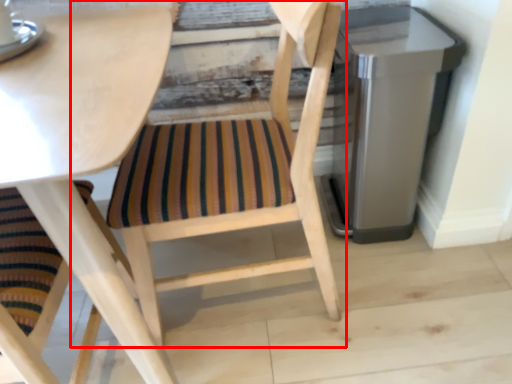
Question: Considering the relative positions of chair (annotated by the red box) and appliance in the image provided, where is chair (annotated by the red box) located with respect to the staircase?

Choices:
 (A) left
 (B) right

Answer: (A)